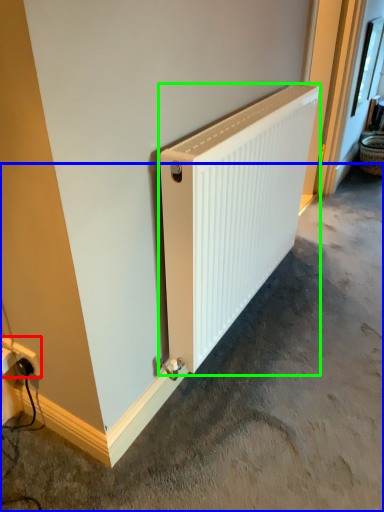
Question: Which object is the closest to the power plugs and sockets (highlighted by a red box)? Choose among these: concrete (highlighted by a blue box) or radiator (highlighted by a green box).

Choices:
 (A) concrete
 (B) radiator

Answer: (B)